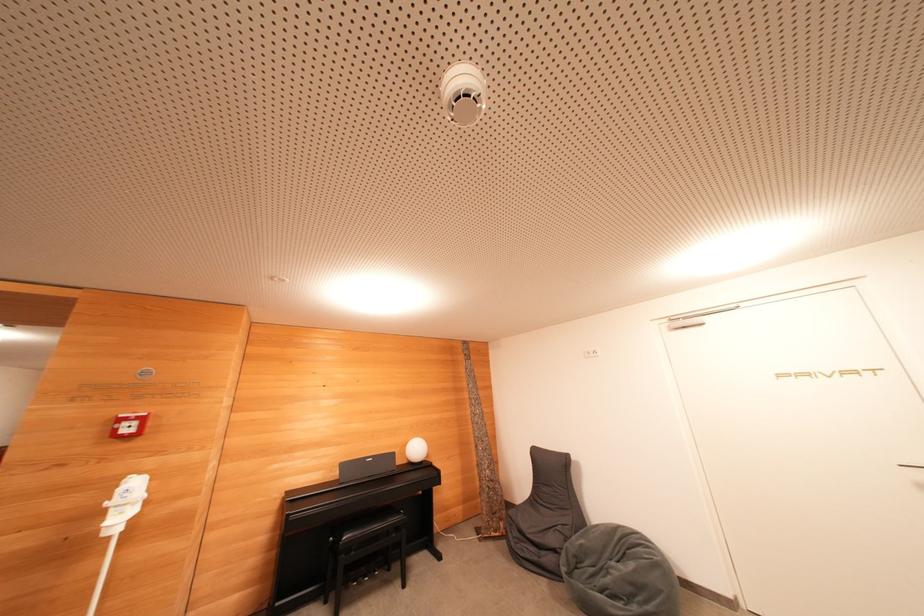
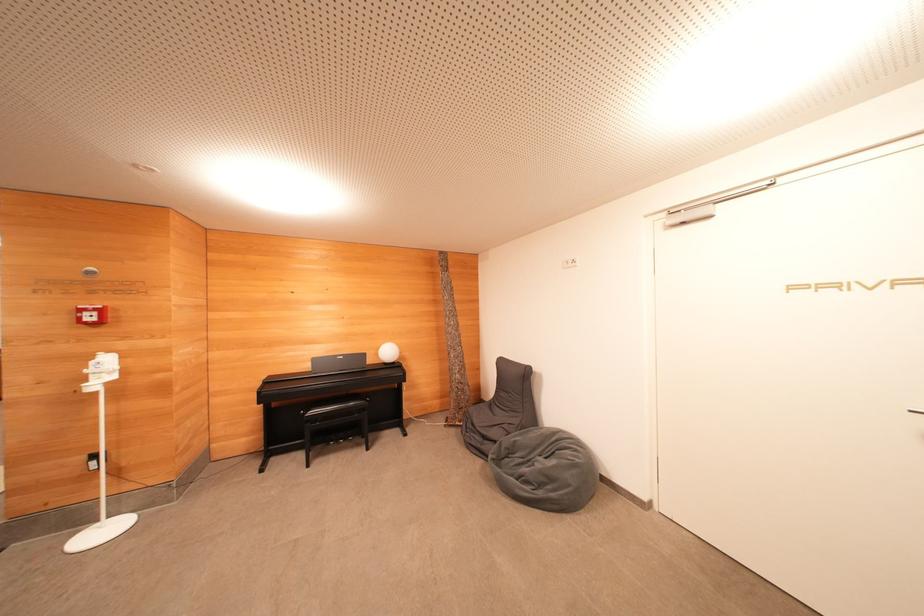
Question: The images are taken continuously from a first-person perspective. In which direction is your viewpoint rotating?

Choices:
 (A) Left
 (B) Right
 (C) Up
 (D) Down

Answer: (D)